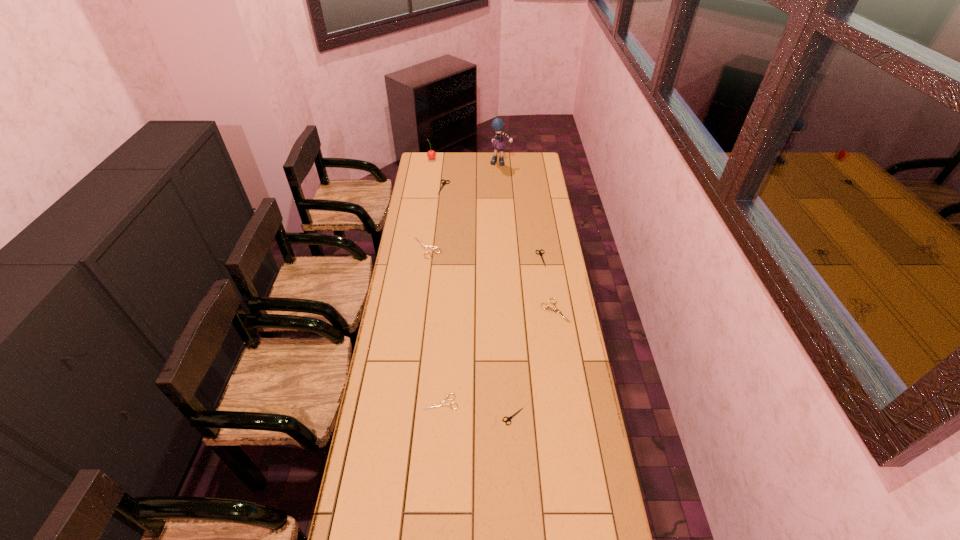
At what (x,y) coordinates should I click in order to perform the action: click on free location located on the front of the nearest beige shears. Please return your answer as a coordinate pair (x, y). Looking at the image, I should click on (439, 432).

Find the location of `free location located 0.260m on the front of the nearest black shears`. free location located 0.260m on the front of the nearest black shears is located at coordinates (518, 507).

Locate an element on the screen. This screenshot has height=540, width=960. rag doll situated at the far edge is located at coordinates tap(497, 124).

Where is `cherry that is at the far edge`? Image resolution: width=960 pixels, height=540 pixels. cherry that is at the far edge is located at coordinates (431, 154).

The width and height of the screenshot is (960, 540). What are the coordinates of `cherry that is at the left edge` in the screenshot? It's located at pos(431,154).

In order to click on object located at the far left corner in this screenshot , I will do `click(431, 154)`.

Locate an element on the screen. The height and width of the screenshot is (540, 960). free space at the left edge of the desktop is located at coordinates (410, 206).

This screenshot has height=540, width=960. In order to click on vacant space at the right edge of the desktop in this screenshot , I will do `click(529, 213)`.

You are a GUI agent. You are given a task and a screenshot of the screen. Output one action in this format:
    pyautogui.click(x=<x>, y=<y>)
    Task: Click on the vacant space at the far right corner of the desktop
    
    Given the screenshot: What is the action you would take?
    pyautogui.click(x=517, y=161)

Image resolution: width=960 pixels, height=540 pixels. What are the coordinates of `vacant region between the red cherry and the rag doll` in the screenshot? It's located at (467, 160).